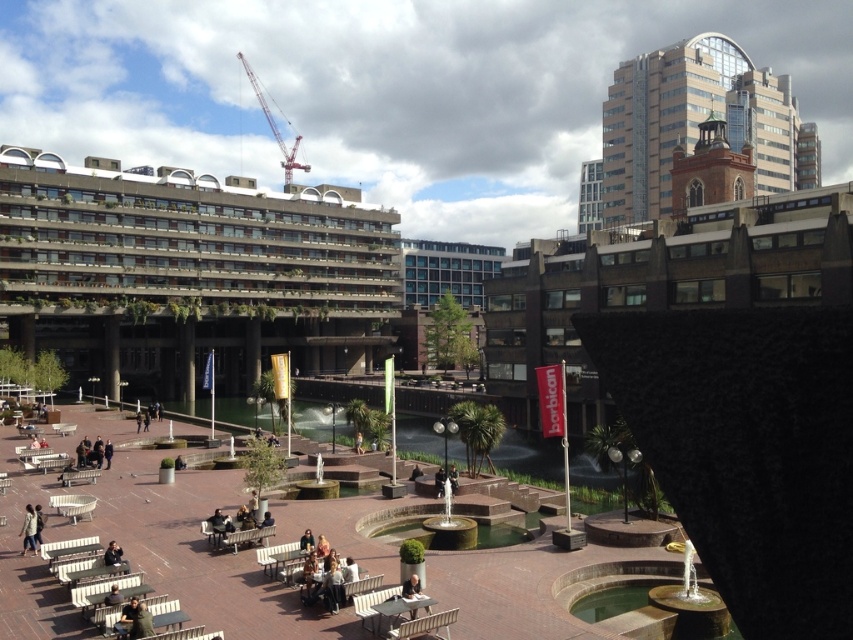
Looking at this image, you are sitting on the light brown wooden chair at lower center and want to get a closer look at the smooth stone fountain at center. In which direction should you move?

The smooth stone fountain at center is to the right of the light brown wooden chair at lower center, so you should move to your right to get closer.

You are standing at the entrance of the plaza and want to sit down. The entrance is located at point 0.0. Where should you go to find the light brown wooden chair at lower center?

You should go to point [410,588] to find the light brown wooden chair at lower center.